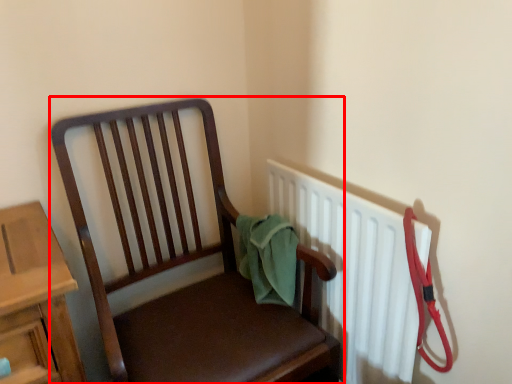
Question: From the image's perspective, considering the relative positions of chair (annotated by the red box) and radiator in the image provided, where is chair (annotated by the red box) located with respect to the staircase?

Choices:
 (A) above
 (B) below

Answer: (B)